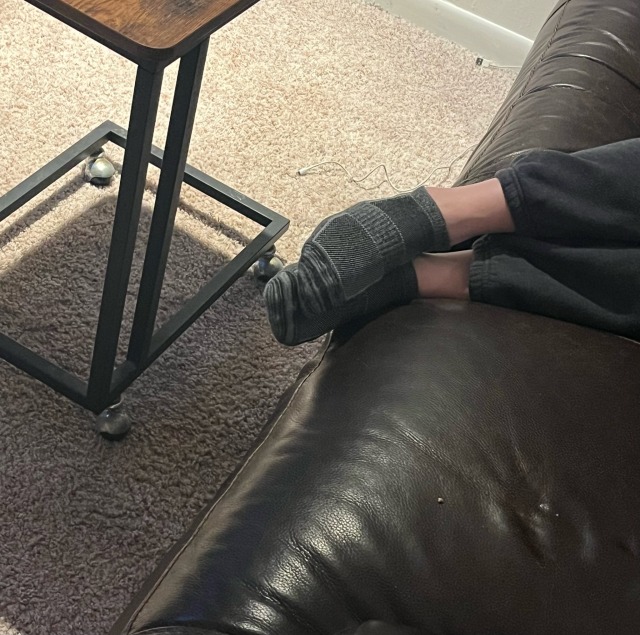
At what (x,y) coordinates should I click in order to perform the action: click on sock. Please return your answer as a coordinate pair (x, y). The height and width of the screenshot is (635, 640). Looking at the image, I should click on (339, 258), (299, 298).